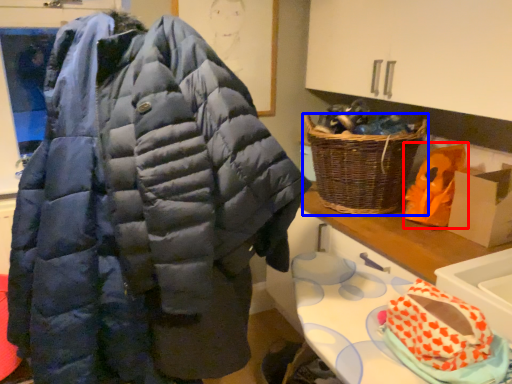
Question: Which of the following is the farthest to the observer, stuff (highlighted by a red box) or picnic basket (highlighted by a blue box)?

Choices:
 (A) stuff
 (B) picnic basket

Answer: (A)